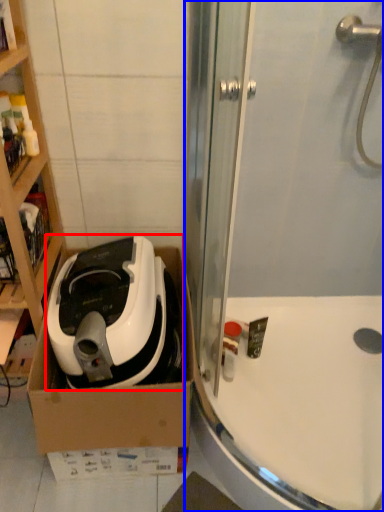
Question: Which point is closer to the camera, home appliance (highlighted by a red box) or shower door (highlighted by a blue box)?

Choices:
 (A) home appliance
 (B) shower door

Answer: (B)